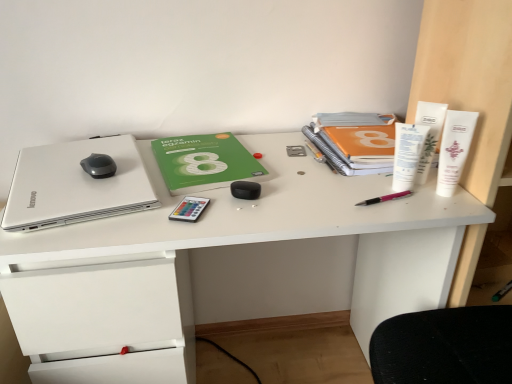
At what (x,y) coordinates should I click in order to perform the action: click on vacant space behind black rubberized mouse at upper left. Please return your answer as a coordinate pair (x, y). Looking at the image, I should click on (101, 148).